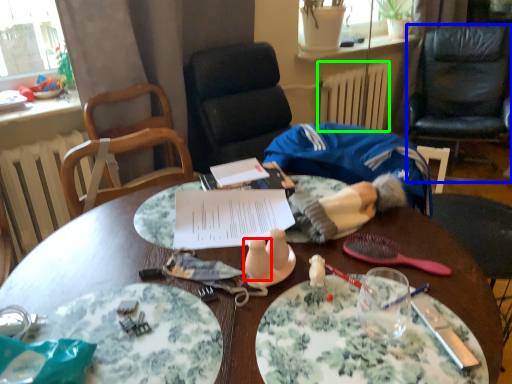
Question: Considering the real-world distances, which object is closest to salt and pepper shakers (highlighted by a red box)? chair (highlighted by a blue box) or radiator (highlighted by a green box).

Choices:
 (A) chair
 (B) radiator

Answer: (B)